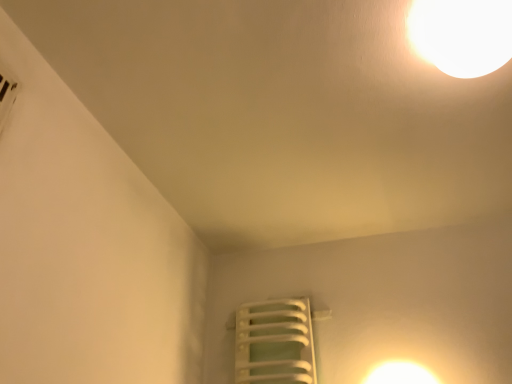
Question: From the image's perspective, is white plastic radiator at lower center on top of white glossy lampshade at upper right?

Choices:
 (A) yes
 (B) no

Answer: (B)

Question: Is white plastic radiator at lower center smaller than white glossy lampshade at upper right?

Choices:
 (A) yes
 (B) no

Answer: (B)

Question: Is white plastic radiator at lower center at the left side of white glossy lampshade at upper right?

Choices:
 (A) yes
 (B) no

Answer: (A)

Question: From a real-world perspective, is white plastic radiator at lower center physically below white glossy lampshade at upper right?

Choices:
 (A) yes
 (B) no

Answer: (A)

Question: Can you confirm if white plastic radiator at lower center is wider than white glossy lampshade at upper right?

Choices:
 (A) no
 (B) yes

Answer: (A)

Question: Is white plastic radiator at lower center outside white glossy lampshade at upper right?

Choices:
 (A) yes
 (B) no

Answer: (A)

Question: From a real-world perspective, is white glossy lampshade at upper right positioned under white plastic radiator at lower center based on gravity?

Choices:
 (A) yes
 (B) no

Answer: (B)

Question: Is white glossy lampshade at upper right to the right of white plastic radiator at lower center from the viewer's perspective?

Choices:
 (A) yes
 (B) no

Answer: (A)

Question: Is white glossy lampshade at upper right at the left side of white plastic radiator at lower center?

Choices:
 (A) no
 (B) yes

Answer: (A)

Question: Can you confirm if white glossy lampshade at upper right is wider than white plastic radiator at lower center?

Choices:
 (A) yes
 (B) no

Answer: (A)

Question: From a real-world perspective, is white glossy lampshade at upper right located higher than white plastic radiator at lower center?

Choices:
 (A) no
 (B) yes

Answer: (B)

Question: Does white glossy lampshade at upper right have a smaller size compared to white plastic radiator at lower center?

Choices:
 (A) no
 (B) yes

Answer: (B)

Question: Is white glossy lampshade at upper right smaller than white glossy light at upper right?

Choices:
 (A) yes
 (B) no

Answer: (B)